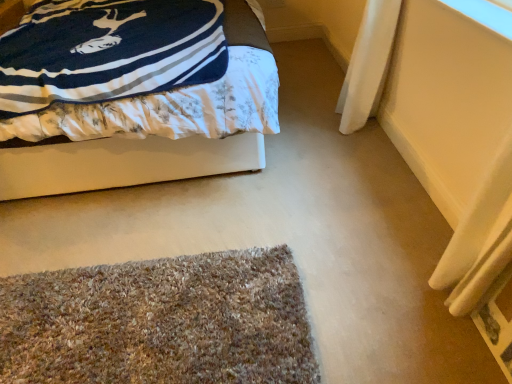
Question: Is multicolored shaggy mat at lower center a part of transparent plastic window screen at upper right?

Choices:
 (A) yes
 (B) no

Answer: (B)

Question: Is the position of transparent plastic window screen at upper right less distant than that of multicolored shaggy mat at lower center?

Choices:
 (A) yes
 (B) no

Answer: (B)

Question: Considering the relative sizes of transparent plastic window screen at upper right and multicolored shaggy mat at lower center in the image provided, is transparent plastic window screen at upper right thinner than multicolored shaggy mat at lower center?

Choices:
 (A) yes
 (B) no

Answer: (A)

Question: Considering the relative sizes of transparent plastic window screen at upper right and multicolored shaggy mat at lower center in the image provided, is transparent plastic window screen at upper right smaller than multicolored shaggy mat at lower center?

Choices:
 (A) no
 (B) yes

Answer: (B)

Question: From the image's perspective, is transparent plastic window screen at upper right located beneath multicolored shaggy mat at lower center?

Choices:
 (A) no
 (B) yes

Answer: (A)

Question: Is transparent plastic window screen at upper right touching multicolored shaggy mat at lower center?

Choices:
 (A) no
 (B) yes

Answer: (A)

Question: Considering the relative positions of multicolored shaggy mat at lower center and velvet-like blue blanket at upper left in the image provided, is multicolored shaggy mat at lower center to the left of velvet-like blue blanket at upper left from the viewer's perspective?

Choices:
 (A) yes
 (B) no

Answer: (B)

Question: Is multicolored shaggy mat at lower center touching velvet-like blue blanket at upper left?

Choices:
 (A) yes
 (B) no

Answer: (B)

Question: Considering the relative positions of multicolored shaggy mat at lower center and velvet-like blue blanket at upper left in the image provided, is multicolored shaggy mat at lower center to the right of velvet-like blue blanket at upper left from the viewer's perspective?

Choices:
 (A) yes
 (B) no

Answer: (A)

Question: From a real-world perspective, is multicolored shaggy mat at lower center positioned over velvet-like blue blanket at upper left based on gravity?

Choices:
 (A) yes
 (B) no

Answer: (B)

Question: From a real-world perspective, does multicolored shaggy mat at lower center sit lower than velvet-like blue blanket at upper left?

Choices:
 (A) no
 (B) yes

Answer: (B)

Question: Is multicolored shaggy mat at lower center facing away from velvet-like blue blanket at upper left?

Choices:
 (A) yes
 (B) no

Answer: (A)

Question: From a real-world perspective, is multicolored shaggy mat at lower center positioned over transparent plastic window screen at upper right based on gravity?

Choices:
 (A) yes
 (B) no

Answer: (B)